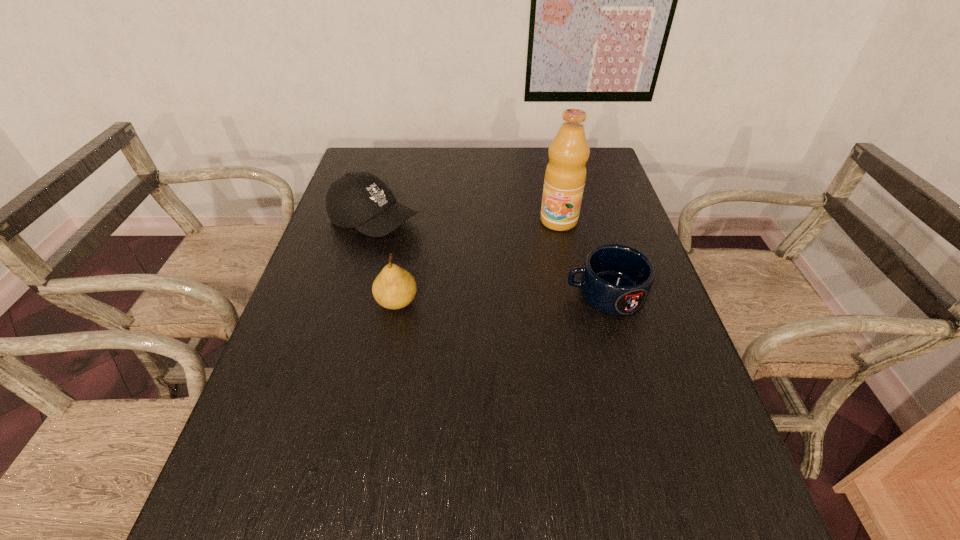
Locate an element on the screen. This screenshot has width=960, height=540. free location located on the front-facing side of the baseball cap is located at coordinates (489, 274).

In order to click on vacant space situated on the front label of the fruit juice in this screenshot , I will do `click(511, 303)`.

The width and height of the screenshot is (960, 540). What are the coordinates of `vacant area situated 0.300m on the front label of the fruit juice` in the screenshot? It's located at (513, 300).

This screenshot has height=540, width=960. I want to click on free space located 0.080m on the front label of the fruit juice, so click(543, 247).

Locate an element on the screen. object present at the left edge is located at coordinates (361, 200).

At what (x,y) coordinates should I click in order to perform the action: click on mug that is positioned at the right edge. Please return your answer as a coordinate pair (x, y). The height and width of the screenshot is (540, 960). Looking at the image, I should click on (616, 279).

You are a GUI agent. You are given a task and a screenshot of the screen. Output one action in this format:
    pyautogui.click(x=<x>, y=<y>)
    Task: Click on the fruit juice that is at the right edge
    
    Given the screenshot: What is the action you would take?
    pyautogui.click(x=565, y=175)

Where is `free space at the far edge`? This screenshot has height=540, width=960. free space at the far edge is located at coordinates (522, 177).

This screenshot has width=960, height=540. Identify the location of vacant space at the left edge of the desktop. (284, 347).

Where is `vacant space at the right edge of the desktop`? The image size is (960, 540). vacant space at the right edge of the desktop is located at coordinates (621, 392).